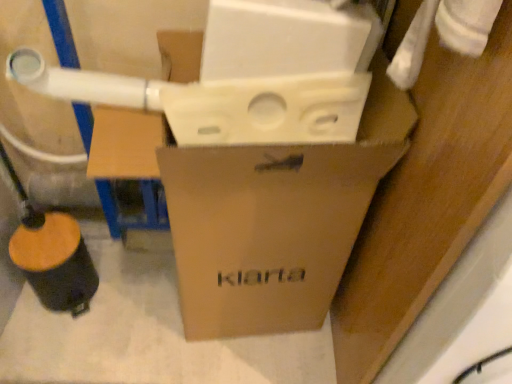
Question: Choose the correct answer: Is wooden/textured water pipe at lower left inside brown cardboard box at center or outside it?

Choices:
 (A) outside
 (B) inside

Answer: (A)

Question: Is wooden/textured water pipe at lower left in front of or behind brown cardboard box at center in the image?

Choices:
 (A) behind
 (B) front

Answer: (A)

Question: From the image's perspective, relative to brown cardboard box at center, is wooden/textured water pipe at lower left above or below?

Choices:
 (A) below
 (B) above

Answer: (A)

Question: In terms of width, does brown cardboard box at center look wider or thinner when compared to wooden/textured water pipe at lower left?

Choices:
 (A) thin
 (B) wide

Answer: (B)

Question: From the image's perspective, is brown cardboard box at center located above or below wooden/textured water pipe at lower left?

Choices:
 (A) above
 (B) below

Answer: (A)

Question: Considering the positions of brown cardboard box at center and wooden/textured water pipe at lower left in the image, is brown cardboard box at center bigger or smaller than wooden/textured water pipe at lower left?

Choices:
 (A) small
 (B) big

Answer: (B)

Question: Considering the relative positions of brown cardboard box at center and wooden/textured water pipe at lower left in the image provided, is brown cardboard box at center to the left or to the right of wooden/textured water pipe at lower left?

Choices:
 (A) right
 (B) left

Answer: (A)